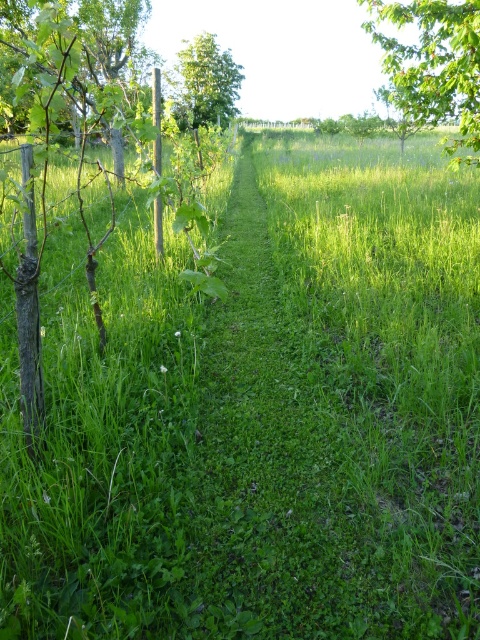
Based on the photo, you are a gardener planning to plant a new row of trees between the green leafy tree at left and the green leafy tree at upper right. Based on their widths, which tree should you use as a reference for spacing to ensure adequate growth space?

The green leafy tree at upper right has a larger width than the green leafy tree at left, so you should use the green leafy tree at upper right as a reference for spacing to ensure adequate growth space.

You are standing at the camera position in the vineyard scene. There is a green leafy tree at left. Can you walk straight ahead towards the rows of plants without getting too close to the tree?

The green leafy tree at left is 2.34 meters away from your current position. Since the path between the rows of plants is likely wider than 2.34 meters, you can walk straight ahead without getting too close to the tree.

You are standing at the point marked as point (450, 58) and want to walk towards the point marked as point (220, 115). Which direction should you move to get closer to your destination?

To move towards point (220, 115) from point (450, 58), you should move upwards because point (220, 115) is further away from the viewer compared to your current position at point (450, 58).